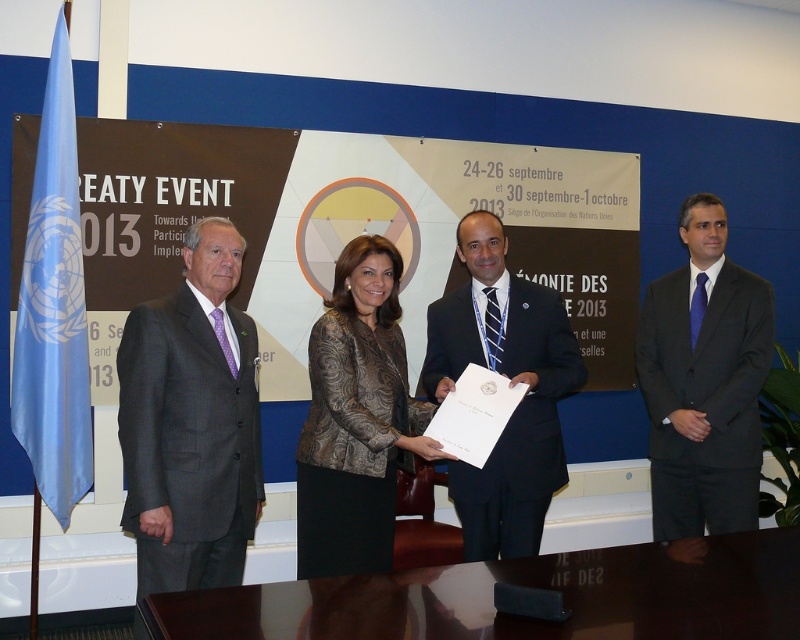
You are attending the Treaty Event 2013 at the UN headquarters. You notice a matte black suit at center and a blue satin flag at left. Which object is closer to the front of the scene?

The matte black suit at center is closer to the front of the scene because it is positioned under the blue satin flag at left, indicating it is in front.

Consider the image. What are the coordinates of the matte black suit at center?

The coordinates of the matte black suit at center are at point (510, 385).